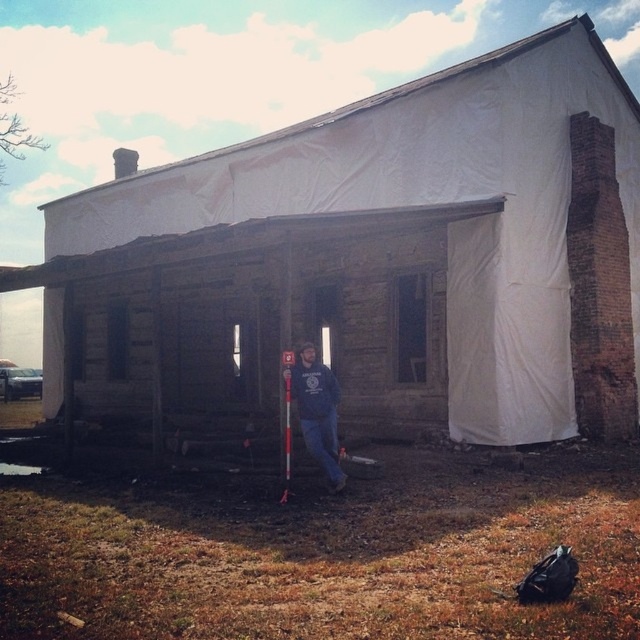
Describe the element at coordinates (404, 218) in the screenshot. The height and width of the screenshot is (640, 640). I see `wooden hut at center` at that location.

Which is in front, point (451, 300) or point (308, 358)?

Point (308, 358)

Is point (528, 435) in front of point (326, 381)?

No.

Identify the location of wooden hut at center. The image size is (640, 640). (404, 218).

Is point (314, 371) more distant than point (289, 364)?

That is True.

Does blue cotton shirt at center have a greater height compared to red plastic ski pole at center?

Correct, blue cotton shirt at center is much taller as red plastic ski pole at center.

Where is `blue cotton shirt at center`? This screenshot has height=640, width=640. blue cotton shirt at center is located at coordinates (316, 410).

Does point (451, 200) come in front of point (288, 442)?

No, it is behind (288, 442).

This screenshot has height=640, width=640. In order to click on wooden hut at center in this screenshot , I will do `click(404, 218)`.

The width and height of the screenshot is (640, 640). Describe the element at coordinates (404, 218) in the screenshot. I see `wooden hut at center` at that location.

Find the location of `wooden hut at center`. wooden hut at center is located at coordinates (404, 218).